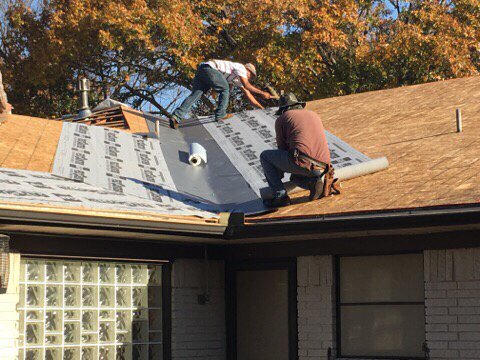
Image resolution: width=480 pixels, height=360 pixels. I want to click on ventilation pipes, so click(x=459, y=119), click(x=84, y=97).